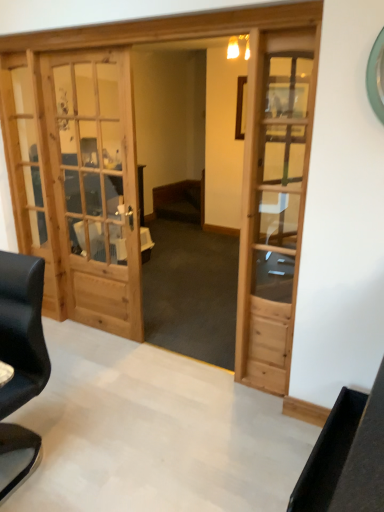
Question: Is light brown wooden door at center a part of wooden table at center?

Choices:
 (A) yes
 (B) no

Answer: (B)

Question: Is the position of wooden table at center more distant than that of light brown wooden door at center?

Choices:
 (A) yes
 (B) no

Answer: (A)

Question: Is wooden table at center with light brown wooden door at center?

Choices:
 (A) yes
 (B) no

Answer: (B)

Question: Is wooden table at center located outside light brown wooden door at center?

Choices:
 (A) yes
 (B) no

Answer: (A)

Question: From a real-world perspective, is wooden table at center under light brown wooden door at center?

Choices:
 (A) no
 (B) yes

Answer: (B)

Question: Considering the relative positions of light brown wooden door at center and black leather chair at left in the image provided, is light brown wooden door at center to the left or to the right of black leather chair at left?

Choices:
 (A) right
 (B) left

Answer: (A)

Question: Considering the positions of point (256, 292) and point (41, 330), is point (256, 292) closer or farther from the camera than point (41, 330)?

Choices:
 (A) farther
 (B) closer

Answer: (A)

Question: From the image's perspective, is light brown wooden door at center above or below black leather chair at left?

Choices:
 (A) below
 (B) above

Answer: (B)

Question: Considering their positions, is light brown wooden door at center located in front of or behind black leather chair at left?

Choices:
 (A) front
 (B) behind

Answer: (B)

Question: From a real-world perspective, is wooden table at center above or below black leather chair at left?

Choices:
 (A) below
 (B) above

Answer: (A)

Question: Is point (142, 253) closer or farther from the camera than point (3, 312)?

Choices:
 (A) farther
 (B) closer

Answer: (A)

Question: Looking at the image, does wooden table at center seem bigger or smaller compared to black leather chair at left?

Choices:
 (A) small
 (B) big

Answer: (A)

Question: Choose the correct answer: Is wooden table at center inside black leather chair at left or outside it?

Choices:
 (A) outside
 (B) inside

Answer: (A)

Question: Looking at the image, does wooden table at center seem bigger or smaller compared to light brown wooden door at center?

Choices:
 (A) big
 (B) small

Answer: (A)

Question: Is point (100, 246) positioned closer to the camera than point (314, 70)?

Choices:
 (A) farther
 (B) closer

Answer: (A)